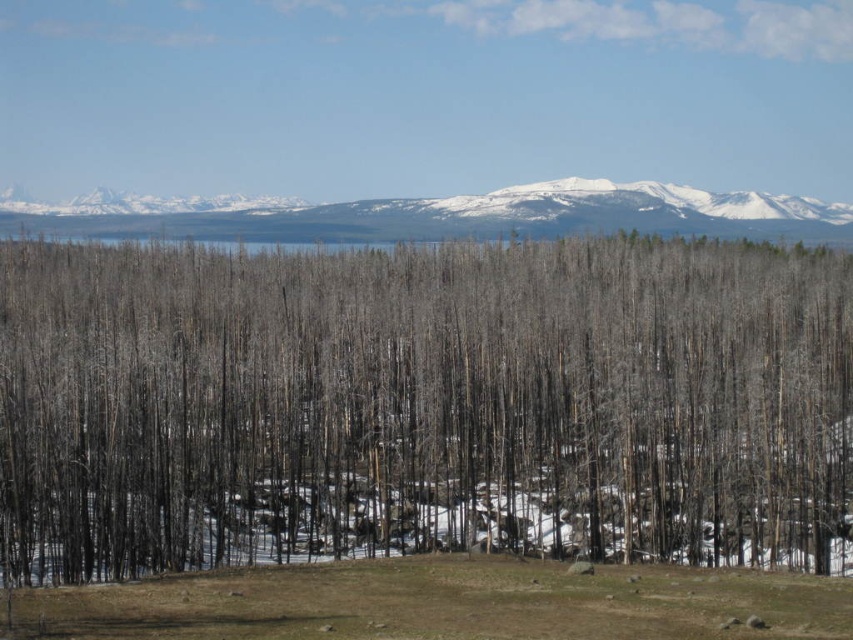
Question: Can you confirm if charred wood trees at center is smaller than snowy granite mountain range at upper center?

Choices:
 (A) yes
 (B) no

Answer: (B)

Question: Does charred wood trees at center lie behind snowy granite mountain range at upper center?

Choices:
 (A) yes
 (B) no

Answer: (B)

Question: Can you confirm if charred wood trees at center is positioned to the left of snowy granite mountain range at upper center?

Choices:
 (A) yes
 (B) no

Answer: (B)

Question: Which point is farther to the camera?

Choices:
 (A) (59, 236)
 (B) (53, 253)

Answer: (A)

Question: Which point is closer to the camera taking this photo?

Choices:
 (A) (177, 378)
 (B) (341, 225)

Answer: (A)